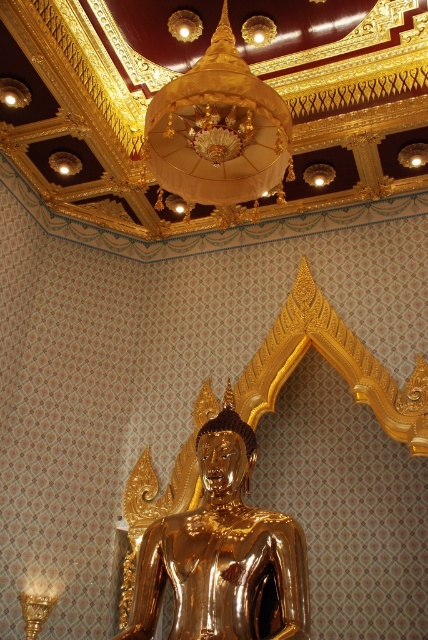
In order to click on gold metallic statue at center in this screenshot , I will do `click(223, 552)`.

Describe the element at coordinates (223, 552) in the screenshot. I see `gold metallic statue at center` at that location.

Locate an element on the screen. Image resolution: width=428 pixels, height=640 pixels. gold metallic statue at center is located at coordinates (223, 552).